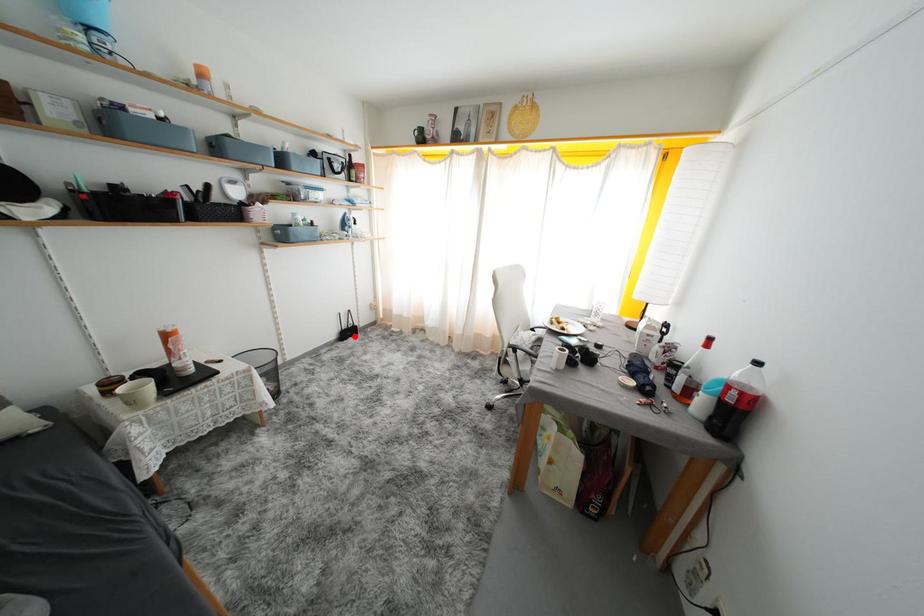
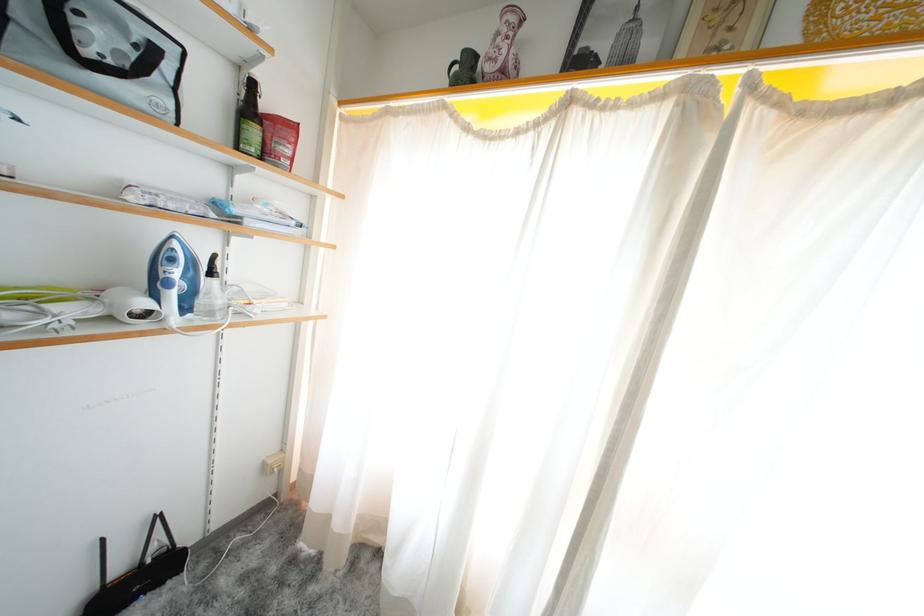
Question: I am providing you with two images of the same scene from different viewpoints. A red point is shown in image1. For the corresponding object point in image2, is it positioned nearer or farther from the camera?

Choices:
 (A) Nearer
 (B) Farther

Answer: (A)